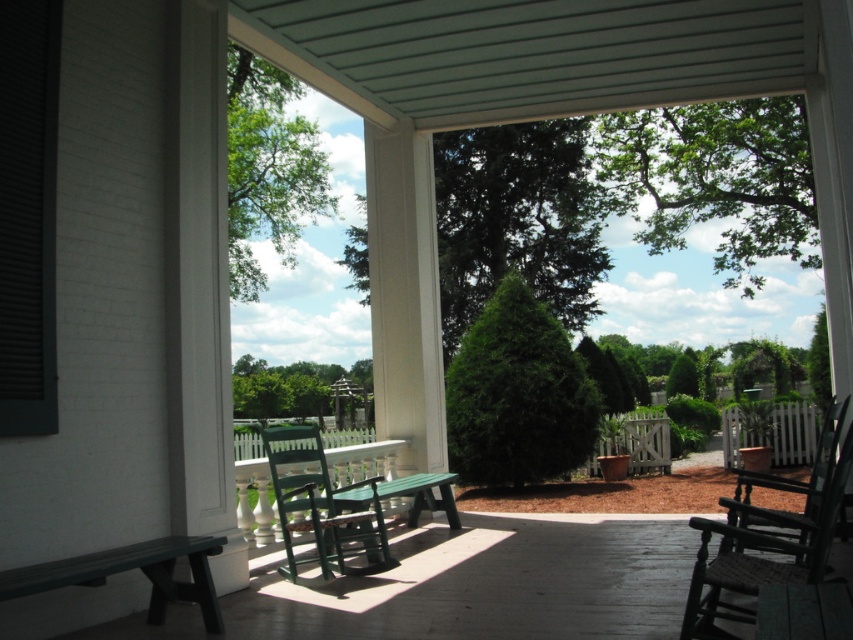
Question: Is rustic woven wood rocking chair at right bigger than green wood rocking chair at center?

Choices:
 (A) yes
 (B) no

Answer: (A)

Question: Is rustic woven wood rocking chair at right to the right of green wood rocking chair at center from the viewer's perspective?

Choices:
 (A) yes
 (B) no

Answer: (A)

Question: Among these objects, which one is nearest to the camera?

Choices:
 (A) green wood rocking chair at center
 (B) green plastic bench at lower left

Answer: (B)

Question: Estimate the real-world distances between objects in this image. Which object is closer to the rustic woven wood rocking chair at right?

Choices:
 (A) green wood rocking chair at center
 (B) green plastic bench at lower left
 (C) green painted wood bench at center

Answer: (C)

Question: Can you confirm if green painted wood bench at center is wider than green wood rocking chair at center?

Choices:
 (A) yes
 (B) no

Answer: (A)

Question: Which point is farther to the camera?

Choices:
 (A) rustic woven wood rocking chair at right
 (B) green painted wood bench at center
 (C) green plastic bench at lower left

Answer: (B)